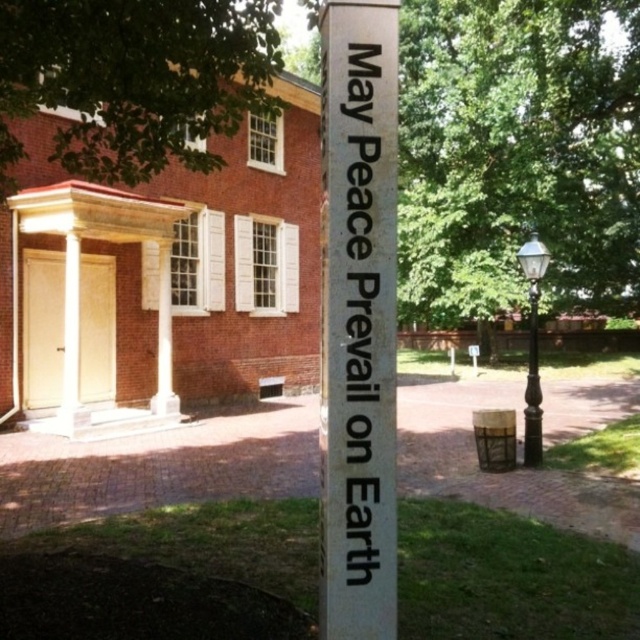
You are a visitor approaching the white glossy sign at center and the black polished metal lamp post at right. Which object will you see first as you walk towards them from the entrance of the brick building?

The white glossy sign at center will be seen first because it is positioned below the black polished metal lamp post at right, meaning it is closer to the entrance and thus encountered earlier during approach.

You are a city planner designing a new park layout. You need to place a new bench between the white glossy sign at center and the black polished metal lamp post at right. Which object should the bench be closer to if it needs to be placed near the thinner structure?

The bench should be placed closer to the white glossy sign at center because it is thinner than the black polished metal lamp post at right.

What is located at the coordinates point [362,250] in the image?

The point [362,250] indicates a white paper sign at center.